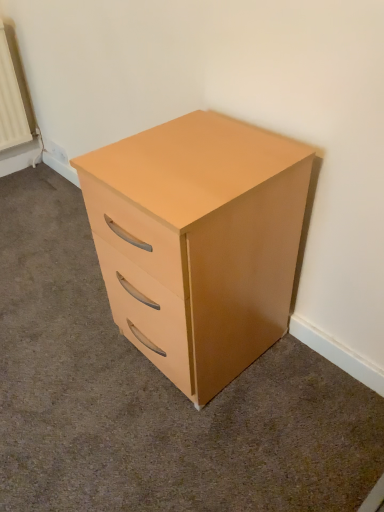
Question: Should I look upward or downward to see matte wood chest of drawers at center?

Choices:
 (A) up
 (B) down

Answer: (B)